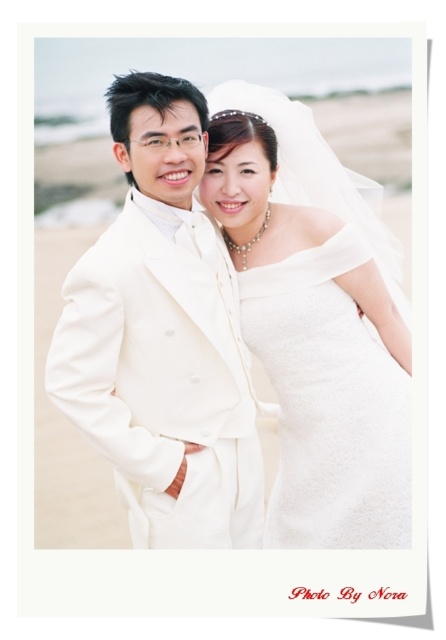
You are a photographer setting up for a beach wedding photo. You have two main subjects in the center of the frame, the matte white suit at center and the satin white dress at center. Which one should you focus on if you want to highlight the larger subject?

The matte white suit at center is bigger than the satin white dress at center, so you should focus on the matte white suit at center to highlight the larger subject.

You are a photographer at a beach wedding. You need to position a small bouquet of white roses between the two central figures to frame the shot. Given the height difference between the matte white suit at center and the satin white dress at center, where should you place the bouquet to ensure both can hold it comfortably?

The bouquet should be placed closer to the satin white dress at center since the matte white suit at center is much taller than the satin white dress at center, allowing both to reach it comfortably.

From the picture: You are a photographer at a beach wedding. You need to position a bouquet between the matte white suit at center and the satin white dress at center so it is closer to the dress. Where should you place the bouquet?

The bouquet should be placed between the matte white suit at center and the satin white dress at center, closer to the satin white dress at center since the matte white suit at center is on the left side of the satin white dress at center.